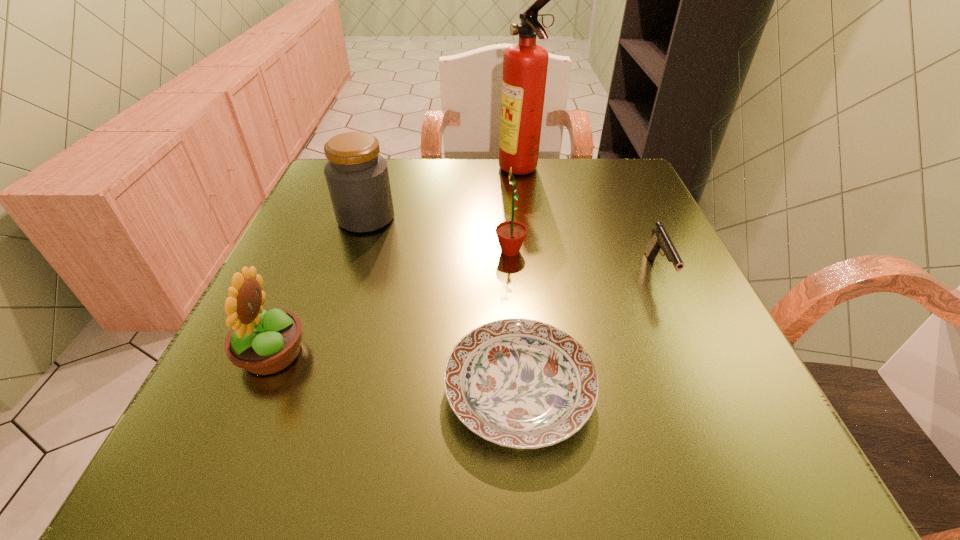
Identify the location of blank area located on the front-facing side of the fire extinguisher. Image resolution: width=960 pixels, height=540 pixels. [x=426, y=171].

Where is `free space located on the face of the right sunflower`? free space located on the face of the right sunflower is located at coordinates (372, 251).

I want to click on vacant area situated on the face of the right sunflower, so click(x=397, y=251).

This screenshot has height=540, width=960. Identify the location of vacant point located on the face of the right sunflower. (392, 251).

Find the location of a particular element. This screenshot has width=960, height=540. blank space located 0.160m on the surface of the second farthest object near the warning symbol is located at coordinates (469, 218).

This screenshot has height=540, width=960. Identify the location of vacant space located 0.100m on the face of the left sunflower. (372, 354).

Identify the location of free spot located at the muzzle of the rightmost object. pos(704,374).

Find the location of a particular element. The image size is (960, 540). free location located 0.380m on the back of the shortest object is located at coordinates (505, 204).

The width and height of the screenshot is (960, 540). In order to click on fire extinguisher present at the far edge in this screenshot , I will do `click(525, 64)`.

Image resolution: width=960 pixels, height=540 pixels. In order to click on jar present at the far edge in this screenshot , I will do `click(357, 177)`.